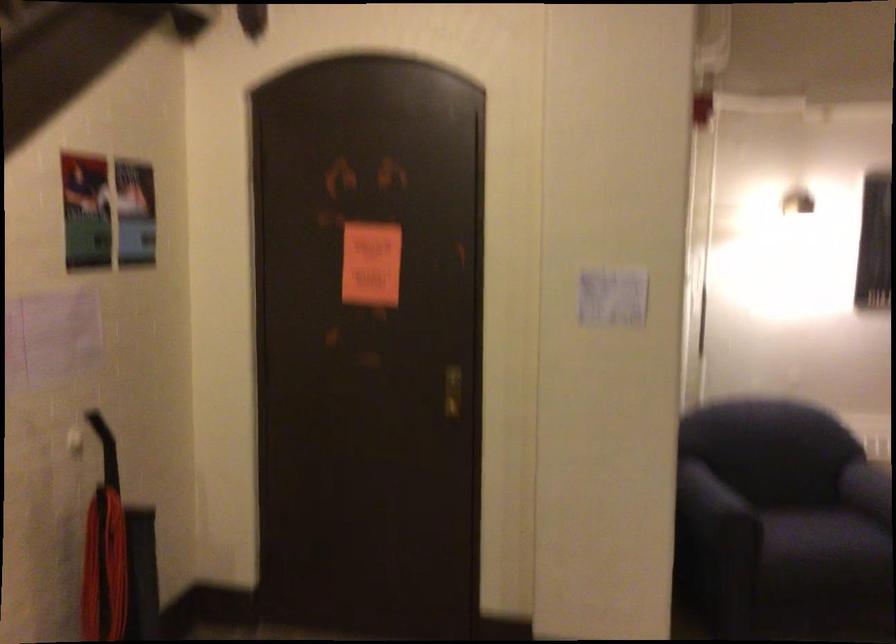
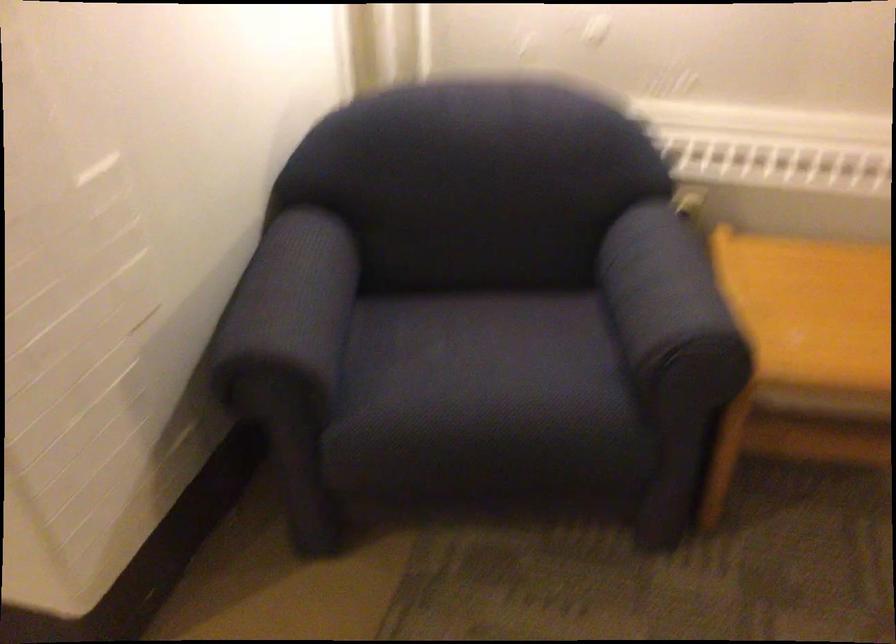
Find the pixel in the second image that matches pixel 806 526 in the first image.

(485, 366)